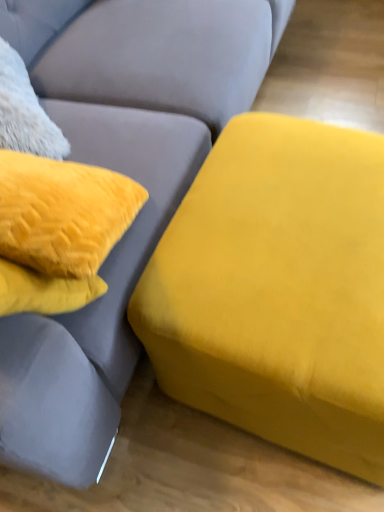
You are a GUI agent. You are given a task and a screenshot of the screen. Output one action in this format:
    pyautogui.click(x=<x>, y=<y>)
    Task: Click on the vacant space situated above velvet yellow ottoman at right, positioned as the 1th studio couch in bottom-to-top order (from a real-world perspective)
    The image size is (384, 512).
    Given the screenshot: What is the action you would take?
    pyautogui.click(x=290, y=223)